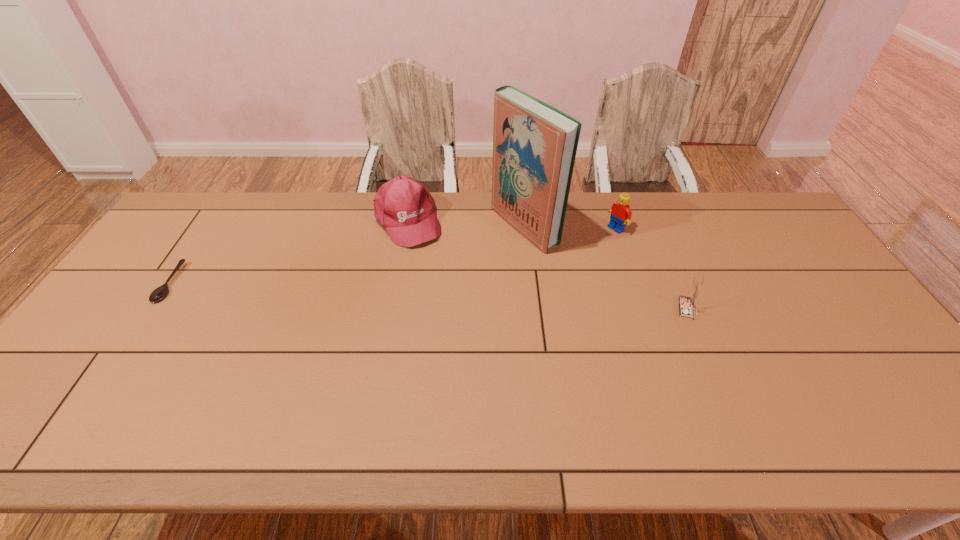
Where is `free space that satisfies the following two spatial constraints: 1. on the front side of the rightmost object; 2. on the right side of the baseball cap`? free space that satisfies the following two spatial constraints: 1. on the front side of the rightmost object; 2. on the right side of the baseball cap is located at coordinates (391, 309).

Locate an element on the screen. Image resolution: width=960 pixels, height=540 pixels. free space that satisfies the following two spatial constraints: 1. on the back side of the hardback book; 2. on the right side of the soupspoon is located at coordinates (207, 226).